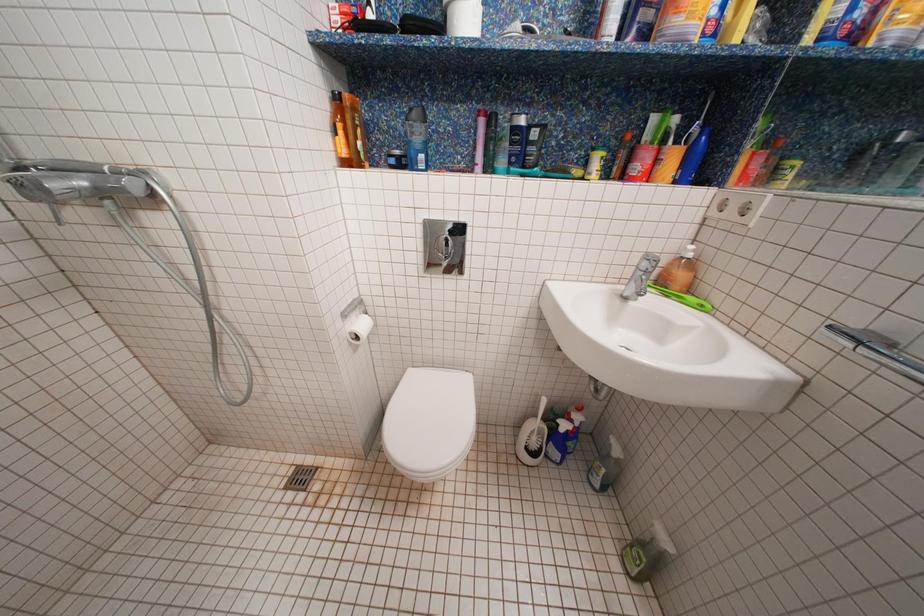
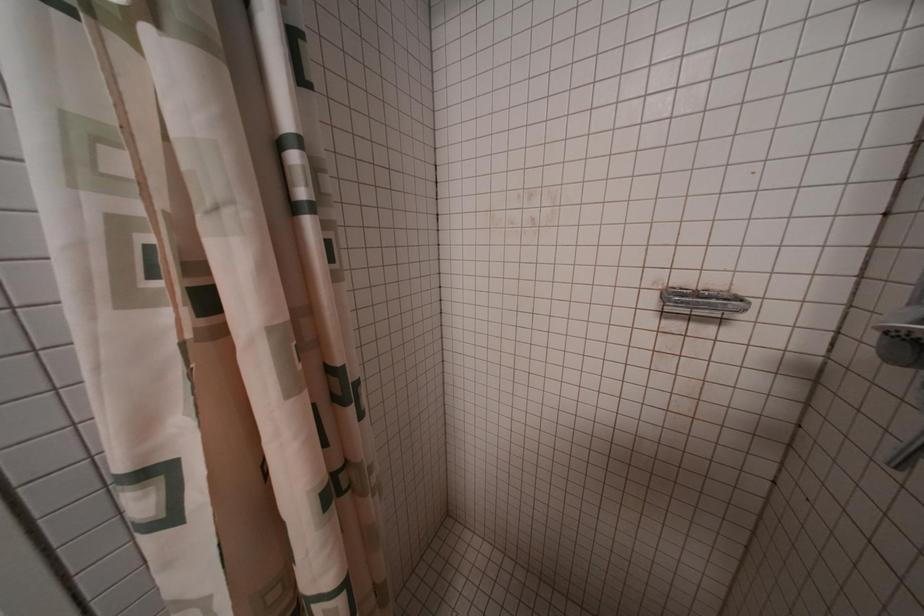
First-person continuous shooting, in which direction is the camera rotating?

The camera rotated toward left-down.